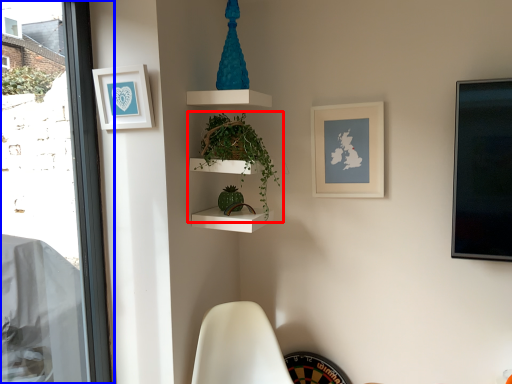
Question: Which object is closer to the camera taking this photo, houseplant (highlighted by a red box) or window (highlighted by a blue box)?

Choices:
 (A) houseplant
 (B) window

Answer: (B)